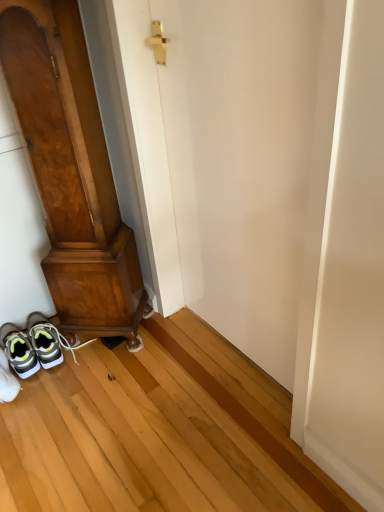
You are a GUI agent. You are given a task and a screenshot of the screen. Output one action in this format:
    pyautogui.click(x=<x>, y=<y>)
    Task: Click on the vacant area located to the right-hand side of white matte sneakers at lower left, which ranks as the 2th footwear in front-to-back order
    This screenshot has height=512, width=384.
    Given the screenshot: What is the action you would take?
    pyautogui.click(x=87, y=366)